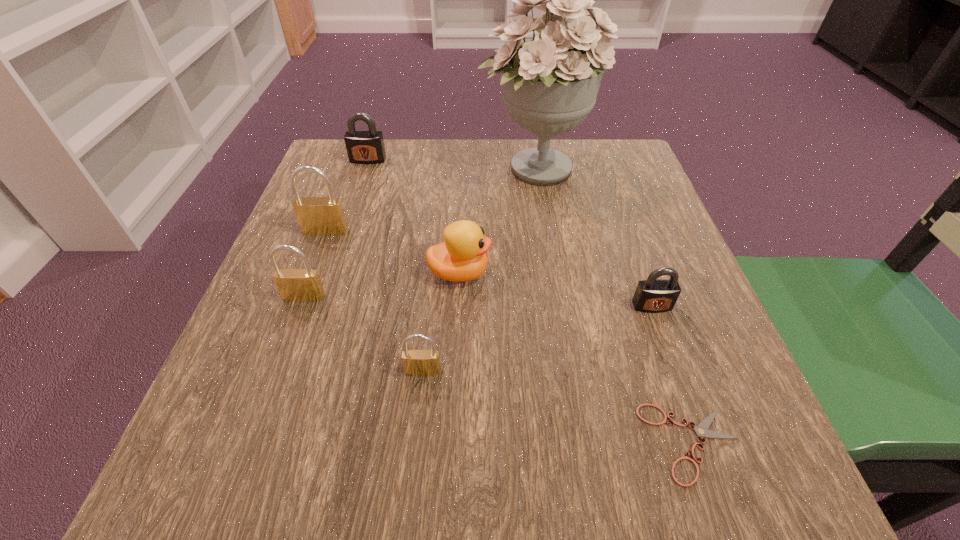
The height and width of the screenshot is (540, 960). What are the coordinates of `free spot between the fourth farthest object and the shortest object` in the screenshot? It's located at (576, 358).

You are a GUI agent. You are given a task and a screenshot of the screen. Output one action in this format:
    pyautogui.click(x=<x>, y=<y>)
    Task: Click on the free space between the tallest object and the tallest padlock
    This screenshot has height=540, width=960.
    Given the screenshot: What is the action you would take?
    pyautogui.click(x=430, y=200)

The height and width of the screenshot is (540, 960). Find the location of `vacant space that's between the duckling and the second nearest brass padlock`. vacant space that's between the duckling and the second nearest brass padlock is located at coordinates (382, 285).

The height and width of the screenshot is (540, 960). I want to click on empty space that is in between the farthest brass padlock and the second smallest brass padlock, so click(x=315, y=264).

This screenshot has height=540, width=960. In order to click on vacant area between the rightmost padlock and the tallest object in this screenshot , I will do `click(593, 237)`.

Find the location of a particular element. The height and width of the screenshot is (540, 960). free space between the shortest object and the second nearest brass padlock is located at coordinates (498, 370).

Locate an element on the screen. The height and width of the screenshot is (540, 960). vacant space in between the sixth nearest object and the second farthest brass padlock is located at coordinates (315, 264).

Locate an element on the screen. vacant region between the shears and the bouquet is located at coordinates (613, 306).

At what (x,y) coordinates should I click in order to perform the action: click on object that stands as the closest to the nearest object. Please return your answer as a coordinate pair (x, y). Looking at the image, I should click on (653, 295).

Image resolution: width=960 pixels, height=540 pixels. Identify the location of the sixth closest object relative to the rightmost padlock. [323, 216].